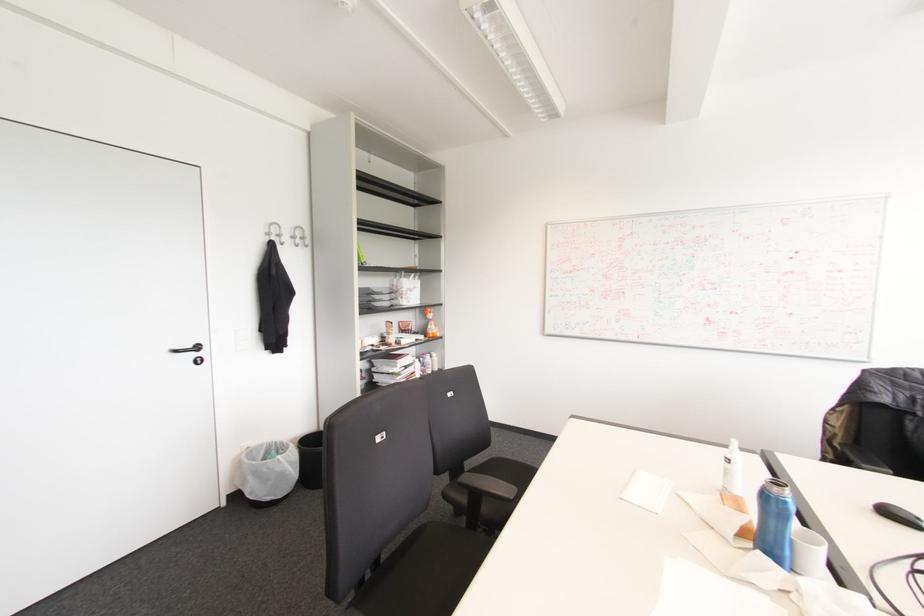
Find the location of a particular element. This screenshot has height=616, width=924. white pump bottle is located at coordinates (732, 469).